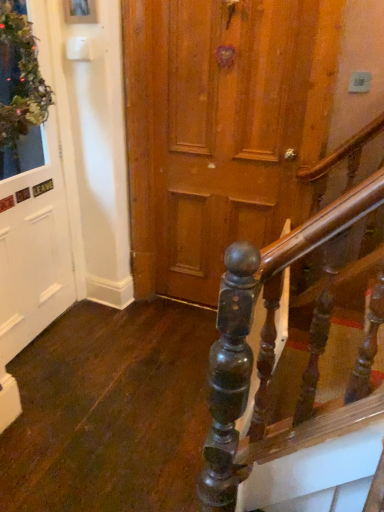
At what (x,y) coordinates should I click in order to perform the action: click on green mossy wreath at upper left. Please return your answer as a coordinate pair (x, y). The width and height of the screenshot is (384, 512). Looking at the image, I should click on (20, 93).

In order to face green mossy wreath at upper left, should I rotate leftwards or rightwards?

Rotate left and turn 22.156 degrees.

This screenshot has height=512, width=384. Describe the element at coordinates (20, 93) in the screenshot. I see `green mossy wreath at upper left` at that location.

Identify the location of white matte door at left. The image size is (384, 512). (34, 241).

The image size is (384, 512). What do you see at coordinates (34, 241) in the screenshot? I see `white matte door at left` at bounding box center [34, 241].

Where is `green mossy wreath at upper left`? The width and height of the screenshot is (384, 512). green mossy wreath at upper left is located at coordinates (20, 93).

Is white matte door at left to the right of green mossy wreath at upper left from the viewer's perspective?

In fact, white matte door at left is to the left of green mossy wreath at upper left.

Which object is closer to the camera, white matte door at left or green mossy wreath at upper left?

green mossy wreath at upper left.

Is point (46, 187) positioned before point (43, 94)?

No, it is not.

From the image's perspective, which one is positioned higher, white matte door at left or green mossy wreath at upper left?

green mossy wreath at upper left is shown above in the image.

From a real-world perspective, is white matte door at left physically located above or below green mossy wreath at upper left?

white matte door at left is below green mossy wreath at upper left.

Considering the sizes of white matte door at left and green mossy wreath at upper left in the image, is white matte door at left wider or thinner than green mossy wreath at upper left?

white matte door at left is thinner than green mossy wreath at upper left.

Who is taller, white matte door at left or green mossy wreath at upper left?

white matte door at left.

Considering the relative sizes of white matte door at left and green mossy wreath at upper left in the image provided, is white matte door at left smaller than green mossy wreath at upper left?

No.

Based on the photo, is white matte door at left not within green mossy wreath at upper left?

white matte door at left lies outside green mossy wreath at upper left's area.

Looking at this image, is white matte door at left far from green mossy wreath at upper left?

Actually, white matte door at left and green mossy wreath at upper left are a little close together.

Does white matte door at left turn towards green mossy wreath at upper left?

Yes, white matte door at left faces towards green mossy wreath at upper left.

Can you tell me how much white matte door at left and green mossy wreath at upper left differ in facing direction?

The angle between the facing direction of white matte door at left and the facing direction of green mossy wreath at upper left is 2.05 degrees.

You are a GUI agent. You are given a task and a screenshot of the screen. Output one action in this format:
    pyautogui.click(x=<x>, y=<y>)
    Task: Click on the door on the left of the green mossy wreath at upper left
    The height and width of the screenshot is (512, 384).
    Given the screenshot: What is the action you would take?
    pyautogui.click(x=34, y=241)

Can you confirm if green mossy wreath at upper left is positioned to the left of white matte door at left?

Incorrect, green mossy wreath at upper left is not on the left side of white matte door at left.

Does green mossy wreath at upper left come behind white matte door at left?

No, green mossy wreath at upper left is closer to the camera.

Which point is more forward, (27,28) or (50,310)?

The point (27,28) is closer.

From the image's perspective, which one is positioned lower, green mossy wreath at upper left or white matte door at left?

white matte door at left.

From a real-world perspective, is green mossy wreath at upper left above or below white matte door at left?

Clearly, from a real-world perspective, green mossy wreath at upper left is above white matte door at left.

Which of these two, green mossy wreath at upper left or white matte door at left, is thinner?

white matte door at left.

Can you confirm if green mossy wreath at upper left is taller than white matte door at left?

Incorrect, the height of green mossy wreath at upper left is not larger of that of white matte door at left.

Considering the sizes of objects green mossy wreath at upper left and white matte door at left in the image provided, who is bigger, green mossy wreath at upper left or white matte door at left?

With larger size is white matte door at left.

Is white matte door at left located within green mossy wreath at upper left?

No, white matte door at left is not a part of green mossy wreath at upper left.

Is green mossy wreath at upper left placed right next to white matte door at left?

green mossy wreath at upper left and white matte door at left are not in contact.

Is green mossy wreath at upper left turned away from white matte door at left?

Yes, white matte door at left is at the back of green mossy wreath at upper left.

How many degrees apart are the facing directions of green mossy wreath at upper left and white matte door at left?

2.05 degrees.

Measure the distance from green mossy wreath at upper left to white matte door at left.

12.05 inches.

Where is `door that is on the left side of green mossy wreath at upper left`? The image size is (384, 512). door that is on the left side of green mossy wreath at upper left is located at coordinates (34, 241).

You are a GUI agent. You are given a task and a screenshot of the screen. Output one action in this format:
    pyautogui.click(x=<x>, y=<y>)
    Task: Click on the window above the white matte door at left (from the image's perspective)
    The width and height of the screenshot is (384, 512).
    Given the screenshot: What is the action you would take?
    [x=20, y=93]

Find the location of `door below the green mossy wreath at upper left (from a real-world perspective)`. door below the green mossy wreath at upper left (from a real-world perspective) is located at coordinates (34, 241).